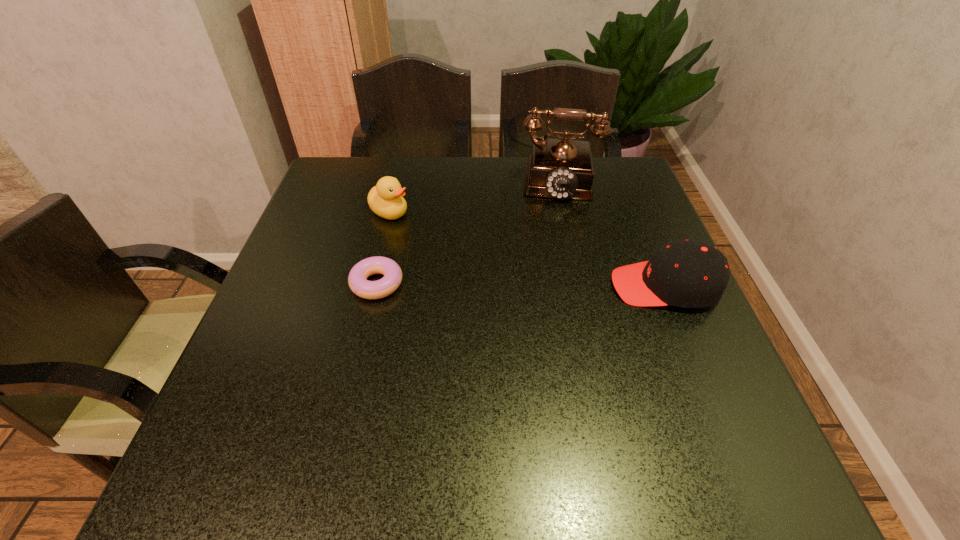
Image resolution: width=960 pixels, height=540 pixels. What are the coordinates of `free region that satisfies the following two spatial constraints: 1. on the front side of the cap; 2. on the front-facing side of the doughnut` in the screenshot? It's located at (376, 286).

Where is `vacant space that satisfies the following two spatial constraints: 1. on the back side of the doughnut; 2. on the left side of the telephone`? Image resolution: width=960 pixels, height=540 pixels. vacant space that satisfies the following two spatial constraints: 1. on the back side of the doughnut; 2. on the left side of the telephone is located at coordinates (401, 178).

Locate an element on the screen. The height and width of the screenshot is (540, 960). free space that satisfies the following two spatial constraints: 1. on the front side of the duckling; 2. on the left side of the doughnut is located at coordinates point(372,284).

I want to click on free space in the image that satisfies the following two spatial constraints: 1. on the front side of the cap; 2. on the front-facing side of the telephone, so click(575, 286).